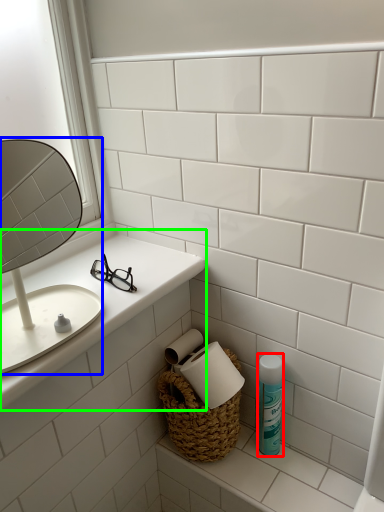
Question: Which is farther away from mouthwash (highlighted by a red box)? mirror (highlighted by a blue box) or counter top (highlighted by a green box)?

Choices:
 (A) mirror
 (B) counter top

Answer: (A)